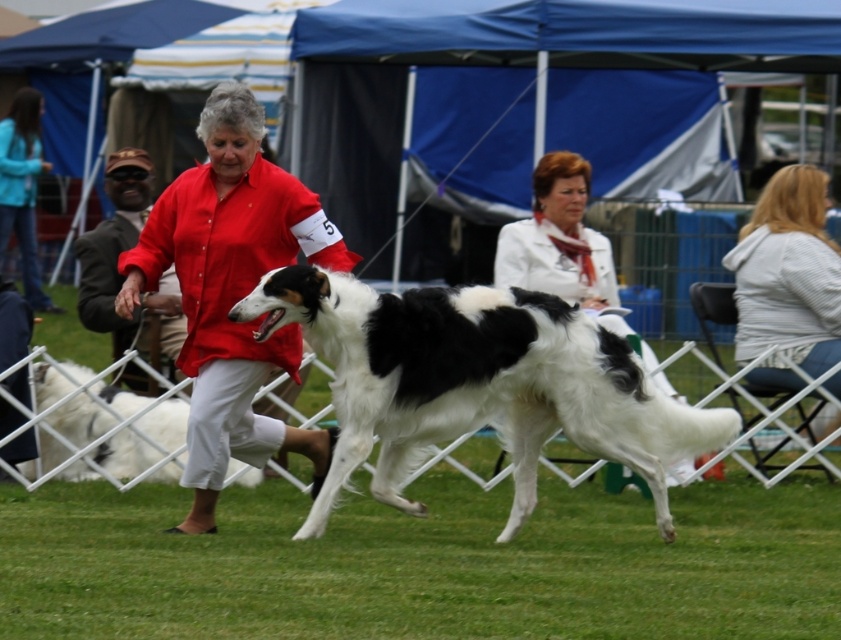
Question: Does matte red shirt at center appear under red cotton shirt at center?

Choices:
 (A) yes
 (B) no

Answer: (A)

Question: Which object is closer to the camera taking this photo?

Choices:
 (A) light gray striped sweater at right
 (B) red cotton shirt at center

Answer: (A)

Question: Is black and white fur at center to the right of matte red shirt at center from the viewer's perspective?

Choices:
 (A) yes
 (B) no

Answer: (A)

Question: Which point appears farthest from the camera in this image?

Choices:
 (A) (24, 104)
 (B) (268, 234)
 (C) (252, 476)

Answer: (A)

Question: Does black and white fur at center appear under white fluffy dog at center?

Choices:
 (A) yes
 (B) no

Answer: (B)

Question: Which of the following is the farthest from the observer?

Choices:
 (A) black and white fur at center
 (B) red cotton shirt at center
 (C) white fluffy dog at center
 (D) white cotton jacket at center

Answer: (B)